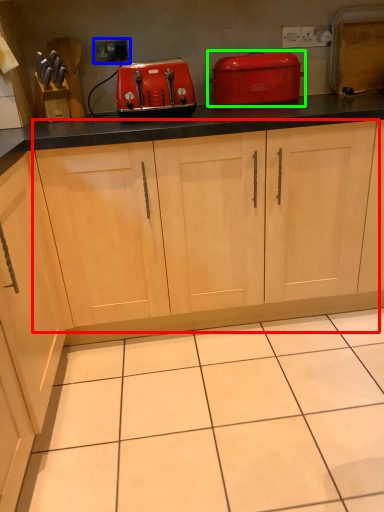
Question: Considering the real-world distances, which object is farthest from cabinetry (highlighted by a red box)? electric outlet (highlighted by a blue box) or home appliance (highlighted by a green box)?

Choices:
 (A) electric outlet
 (B) home appliance

Answer: (A)